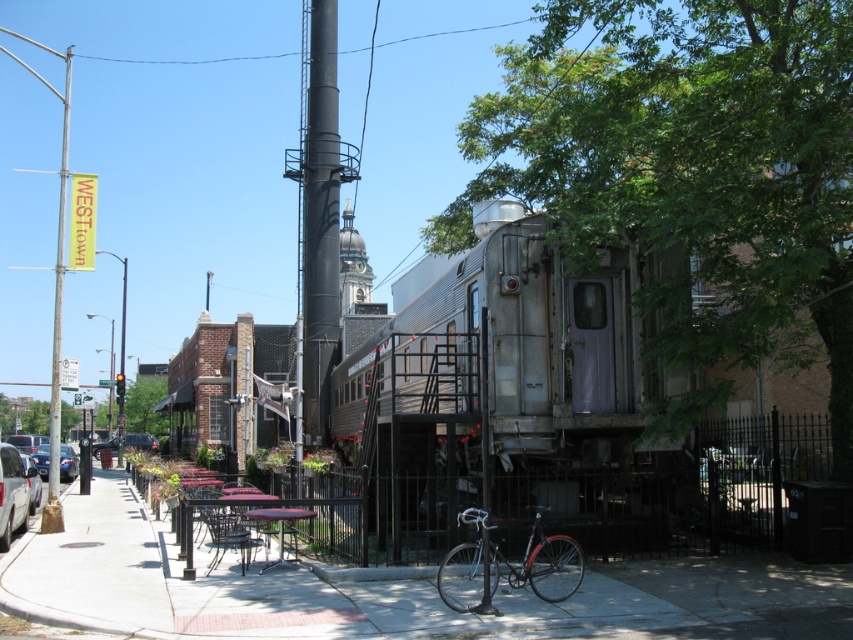
Between point (3, 448) and point (141, 444), which one is positioned behind?

Point (141, 444)

Is silver metallic car at lower left to the right of matte black car at lower left from the viewer's perspective?

Indeed, silver metallic car at lower left is positioned on the right side of matte black car at lower left.

Image resolution: width=853 pixels, height=640 pixels. I want to click on silver metallic car at lower left, so click(12, 493).

Locate an element on the screen. Image resolution: width=853 pixels, height=640 pixels. silver metallic car at lower left is located at coordinates point(12,493).

Does black matte pole at center have a greater width compared to shiny silver sedan at left?

No.

Does black matte pole at center have a lesser height compared to shiny silver sedan at left?

No, black matte pole at center is not shorter than shiny silver sedan at left.

Between point (331, 353) and point (67, 461), which one is positioned behind?

The point (67, 461) is more distant.

Where is `black matte pole at center`? The width and height of the screenshot is (853, 640). black matte pole at center is located at coordinates (320, 221).

Consider the image. Is concrete sidewalk at lower left thinner than matte black car at lower left?

In fact, concrete sidewalk at lower left might be wider than matte black car at lower left.

Measure the distance from concrete sidewalk at lower left to matte black car at lower left.

concrete sidewalk at lower left is 114.27 feet away from matte black car at lower left.

Who is more distant from viewer, (102, 499) or (111, 442)?

The point (111, 442) is more distant.

You are a GUI agent. You are given a task and a screenshot of the screen. Output one action in this format:
    pyautogui.click(x=<x>, y=<y>)
    Task: Click on the concrete sidewalk at lower left
    The image size is (853, 640).
    Given the screenshot: What is the action you would take?
    pyautogui.click(x=387, y=589)